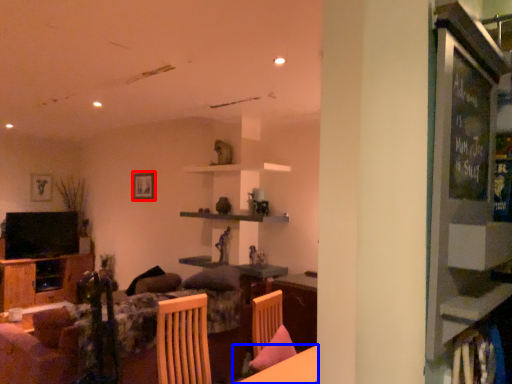
Question: Which object is closer to the camera taking this photo, picture frame (highlighted by a red box) or table (highlighted by a blue box)?

Choices:
 (A) picture frame
 (B) table

Answer: (B)